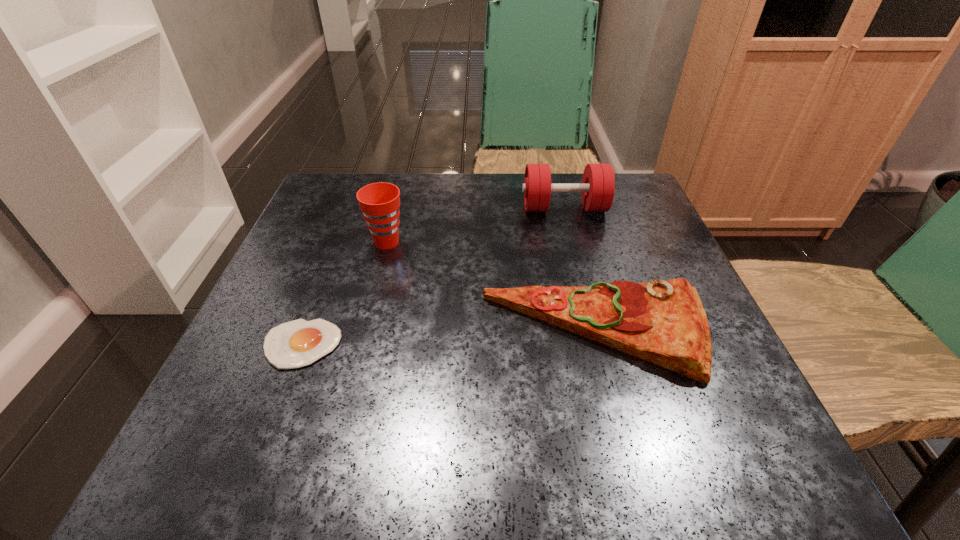
The image size is (960, 540). What are the coordinates of `blank region between the cup and the shortest object` in the screenshot? It's located at (344, 293).

Identify the location of free space between the shortest object and the third tallest object. The width and height of the screenshot is (960, 540). (449, 339).

Find the location of `vacant space that is in between the farthest object and the egg yolk`. vacant space that is in between the farthest object and the egg yolk is located at coordinates (433, 276).

At what (x,y) coordinates should I click in order to perform the action: click on object that is the nearest to the dumbbell. Please return your answer as a coordinate pair (x, y). The height and width of the screenshot is (540, 960). Looking at the image, I should click on (663, 322).

I want to click on object that can be found as the third closest to the third nearest object, so click(598, 183).

Locate an element on the screen. The width and height of the screenshot is (960, 540). vacant space that satisfies the following two spatial constraints: 1. on the back side of the pizza; 2. on the right side of the egg yolk is located at coordinates (306, 333).

Find the location of a particular element. The height and width of the screenshot is (540, 960). vacant space that satisfies the following two spatial constraints: 1. on the back side of the second farthest object; 2. on the left side of the dumbbell is located at coordinates (396, 208).

Locate an element on the screen. This screenshot has width=960, height=540. vacant area that satisfies the following two spatial constraints: 1. on the front side of the farthest object; 2. on the right side of the third tallest object is located at coordinates (596, 333).